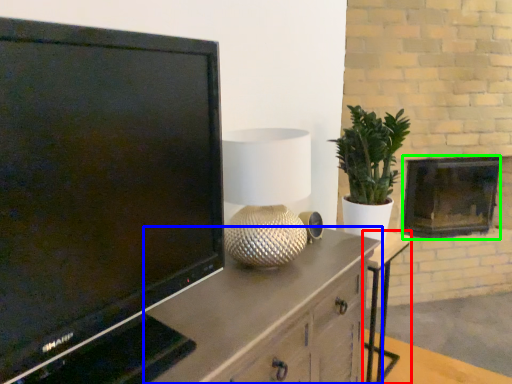
Question: Which object is the farthest from table (highlighted by a red box)? Choose among these: cabinetry (highlighted by a blue box) or fireplace (highlighted by a green box).

Choices:
 (A) cabinetry
 (B) fireplace

Answer: (A)